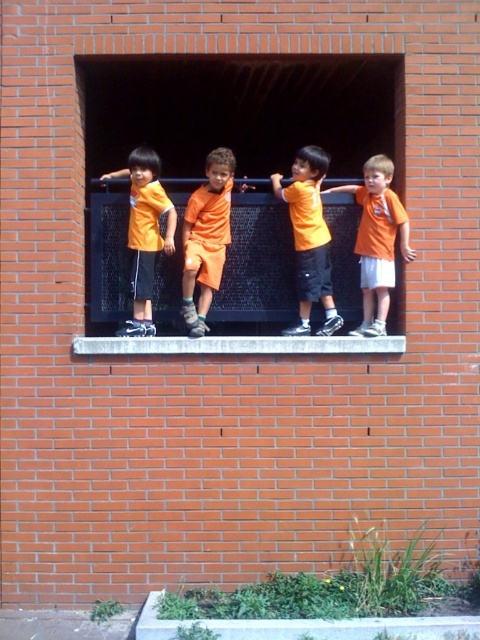
You are a photographer trying to capture the children at the edge of the opening. Based on the scene, which object in the image takes up more space in the frame? Please choose between the concrete at center and the orange matte shirt at right.

Answer: The orange matte shirt at right takes up more space in the frame because the concrete at center is smaller than orange matte shirt at right.

You are a photographer standing in front of the brick wall with the rectangular opening. You want to take a photo of the matte orange shirt at left and the white stone at center. Which object should you adjust your focus on first to ensure both are in the frame?

The matte orange shirt at left is closer to you than the white stone at center, so you should focus on the matte orange shirt at left first to ensure both are in the frame.

You are a parent trying to assess the safety of the area where your children are standing. The scene shows the children near a rectangular opening in a brick wall. Based on the image, which object is shorter between the concrete at center and the orange matte shirt at right?

The concrete at center is not as tall as the orange matte shirt at right, so the concrete at center is shorter.